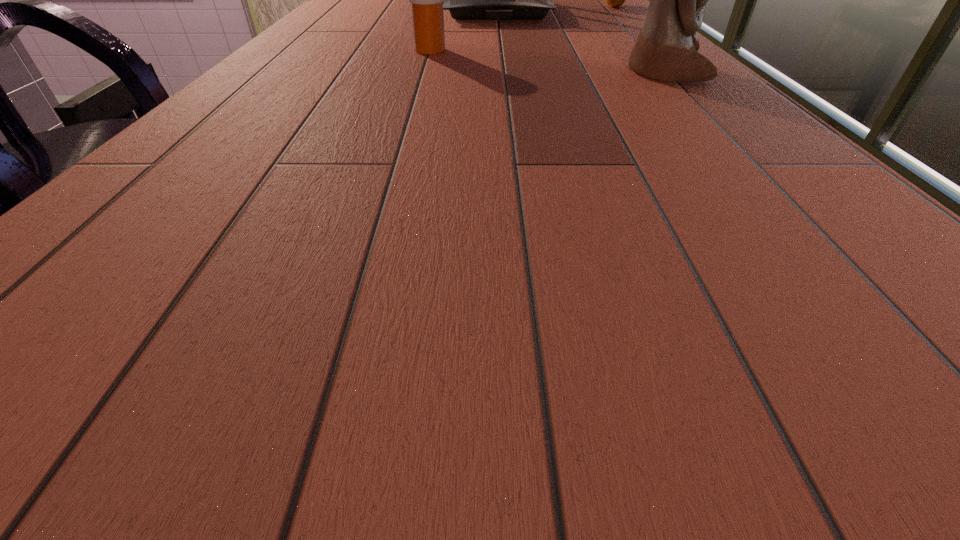
The height and width of the screenshot is (540, 960). In the image, there is a desktop. Find the location of `free space at the left edge`. free space at the left edge is located at coordinates (365, 35).

What are the coordinates of `blank space at the right edge of the desktop` in the screenshot? It's located at (700, 153).

The image size is (960, 540). Find the location of `vacant region at the far left corner`. vacant region at the far left corner is located at coordinates (384, 4).

Where is `empty space between the nearest object and the third shortest object`? The image size is (960, 540). empty space between the nearest object and the third shortest object is located at coordinates (580, 42).

I want to click on unoccupied area between the third tallest object and the nearest object, so click(x=546, y=62).

The width and height of the screenshot is (960, 540). In order to click on vacant space that is in between the tallest object and the third shortest object in this screenshot , I will do `click(580, 42)`.

Locate an element on the screen. The image size is (960, 540). free space that is in between the router and the tallest object is located at coordinates (580, 42).

Where is `vacant area that lies between the second tallest object and the nearest object`? This screenshot has width=960, height=540. vacant area that lies between the second tallest object and the nearest object is located at coordinates point(580,42).

Image resolution: width=960 pixels, height=540 pixels. In order to click on free space that is in between the third farthest object and the shortest object in this screenshot , I will do `click(521, 29)`.

You are a GUI agent. You are given a task and a screenshot of the screen. Output one action in this format:
    pyautogui.click(x=<x>, y=<y>)
    Task: Click on the free area in between the second nearest object and the shortest object
    This screenshot has width=960, height=540.
    Given the screenshot: What is the action you would take?
    pyautogui.click(x=521, y=29)